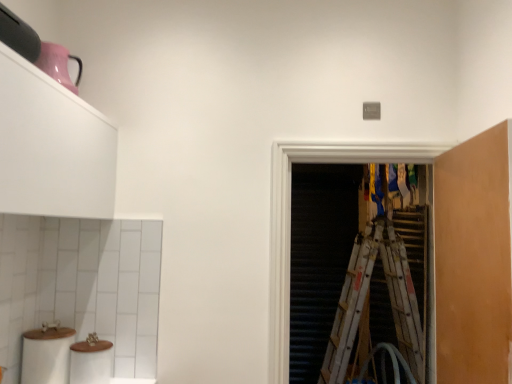
Question: Is transparent plastic screen door at center not near wooden ladder at right?

Choices:
 (A) yes
 (B) no

Answer: (A)

Question: Does transparent plastic screen door at center have a greater width compared to wooden ladder at right?

Choices:
 (A) yes
 (B) no

Answer: (A)

Question: From a real-world perspective, is transparent plastic screen door at center physically above wooden ladder at right?

Choices:
 (A) no
 (B) yes

Answer: (B)

Question: From the image's perspective, would you say transparent plastic screen door at center is shown under wooden ladder at right?

Choices:
 (A) no
 (B) yes

Answer: (A)

Question: Can you confirm if transparent plastic screen door at center is positioned to the right of wooden ladder at right?

Choices:
 (A) no
 (B) yes

Answer: (A)

Question: Is wooden ladder at right surrounded by transparent plastic screen door at center?

Choices:
 (A) yes
 (B) no

Answer: (B)

Question: Can you confirm if white matte toilet paper at lower left is shorter than white matte cabinet at upper left, arranged as the 2th cabinetry when viewed from the right?

Choices:
 (A) no
 (B) yes

Answer: (B)

Question: Considering the relative positions of white matte toilet paper at lower left and white matte cabinet at upper left, which is the first cabinetry in left-to-right order, in the image provided, is white matte toilet paper at lower left to the right of white matte cabinet at upper left, which is the first cabinetry in left-to-right order, from the viewer's perspective?

Choices:
 (A) no
 (B) yes

Answer: (A)

Question: Can you confirm if white matte toilet paper at lower left is smaller than white matte cabinet at upper left, which is the first cabinetry in left-to-right order?

Choices:
 (A) yes
 (B) no

Answer: (A)

Question: From the image's perspective, is white matte toilet paper at lower left located beneath white matte cabinet at upper left, which is the first cabinetry in left-to-right order?

Choices:
 (A) yes
 (B) no

Answer: (A)

Question: Is white matte toilet paper at lower left oriented away from white matte cabinet at upper left, which is the first cabinetry in left-to-right order?

Choices:
 (A) yes
 (B) no

Answer: (B)

Question: Is white matte toilet paper at lower left positioned beyond the bounds of white matte cabinet at upper left, which is the first cabinetry in left-to-right order?

Choices:
 (A) yes
 (B) no

Answer: (A)

Question: From the image's perspective, would you say wooden ladder at right is positioned over transparent plastic screen door at center?

Choices:
 (A) yes
 (B) no

Answer: (B)